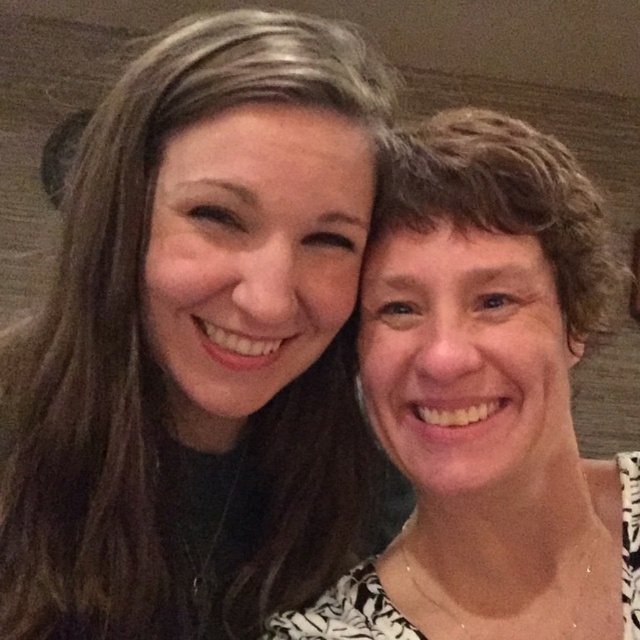
Question: Observing the image, what is the correct spatial positioning of smooth brown hair at upper left in reference to matte black hair at right?

Choices:
 (A) right
 (B) left

Answer: (B)

Question: Is the position of smooth brown hair at upper left more distant than that of matte black hair at right?

Choices:
 (A) no
 (B) yes

Answer: (B)

Question: Is smooth brown hair at upper left in front of matte black hair at right?

Choices:
 (A) no
 (B) yes

Answer: (A)

Question: Which point is farther to the camera?

Choices:
 (A) smooth brown hair at upper left
 (B) matte black hair at right

Answer: (A)

Question: Which point is farther to the camera?

Choices:
 (A) (429, 305)
 (B) (177, 422)

Answer: (B)

Question: Which point appears closest to the camera in this image?

Choices:
 (A) (113, 100)
 (B) (426, 225)

Answer: (B)